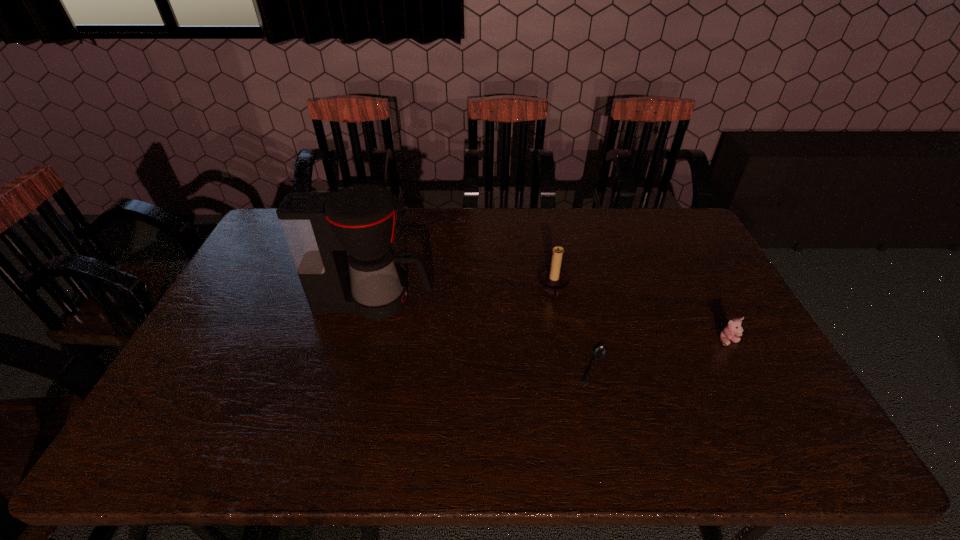
At what (x,y) coordinates should I click in order to perform the action: click on vacant space that's between the candle holder and the third tallest object. Please return your answer as a coordinate pair (x, y). Looking at the image, I should click on (641, 315).

Where is `free spot between the third shortest object and the tallest object`? Image resolution: width=960 pixels, height=540 pixels. free spot between the third shortest object and the tallest object is located at coordinates (464, 295).

The height and width of the screenshot is (540, 960). I want to click on blank region between the nearest object and the coffee maker, so [484, 334].

Locate an element on the screen. The width and height of the screenshot is (960, 540). free space that is in between the third tallest object and the tallest object is located at coordinates (551, 321).

Where is `vacant area that lies between the third shortest object and the second shortest object`? This screenshot has height=540, width=960. vacant area that lies between the third shortest object and the second shortest object is located at coordinates pyautogui.click(x=641, y=315).

This screenshot has width=960, height=540. Find the location of `vacant area between the candle holder and the shortest object`. vacant area between the candle holder and the shortest object is located at coordinates (573, 328).

Locate an element on the screen. vacant region between the second nearest object and the second tallest object is located at coordinates (641, 315).

Where is `vacant space that's between the rightmost object and the shortest object`? vacant space that's between the rightmost object and the shortest object is located at coordinates (661, 354).

Where is `empty space that is in between the coffee maker and the candle holder`? empty space that is in between the coffee maker and the candle holder is located at coordinates (464, 295).

The width and height of the screenshot is (960, 540). Identify the location of unoccupied area between the nearest object and the candle holder. (573, 328).